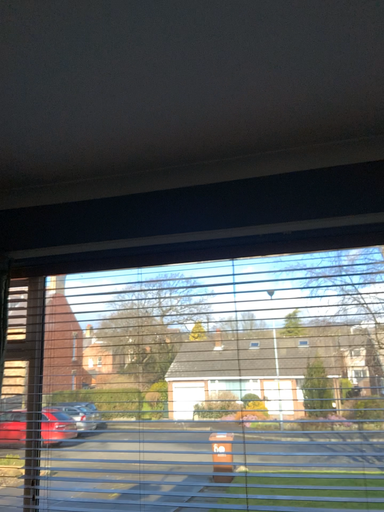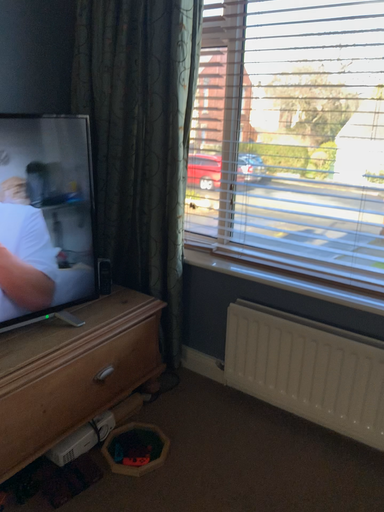
Question: How did the camera likely rotate when shooting the video?

Choices:
 (A) rotated downward
 (B) rotated upward

Answer: (A)